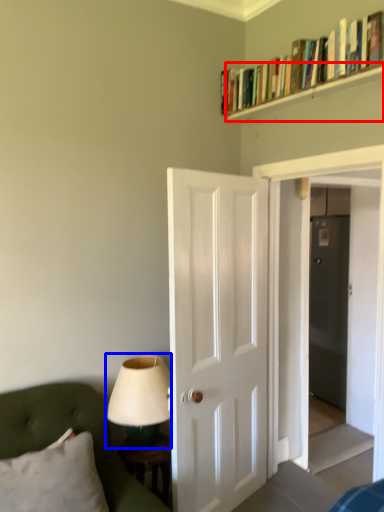
Question: Which point is closer to the camera, shelf (highlighted by a red box) or table lamp (highlighted by a blue box)?

Choices:
 (A) shelf
 (B) table lamp

Answer: (A)